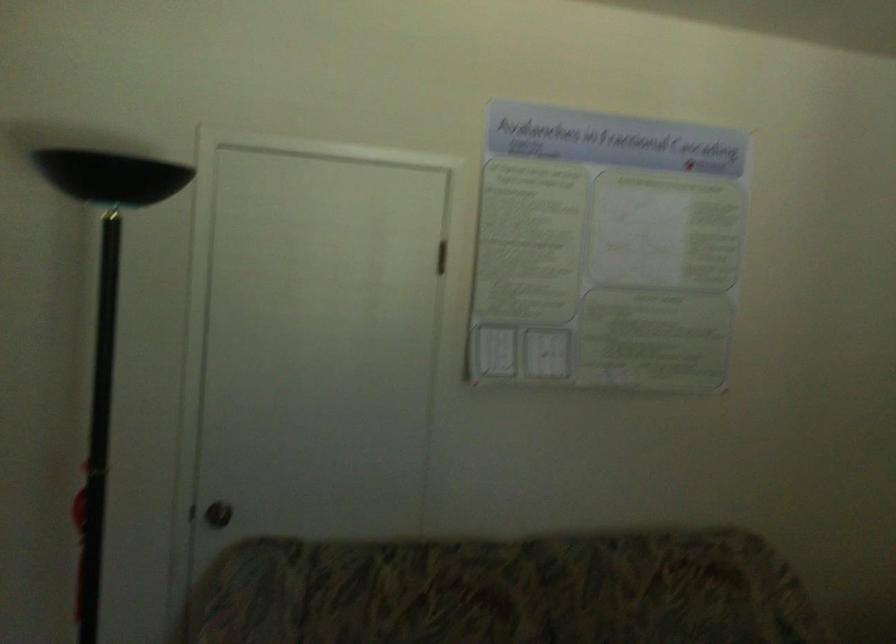
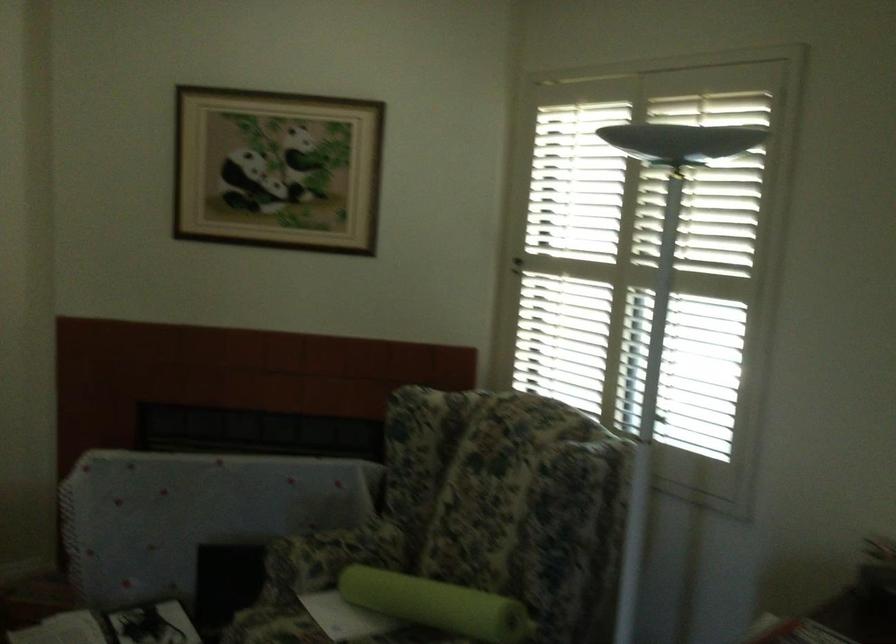
Question: The camera is either moving clockwise (left) or counter-clockwise (right) around the object. The first image is from the beginning of the video and the second image is from the end. Is the camera moving left or right when shooting the video?

Choices:
 (A) Left
 (B) Right

Answer: (A)